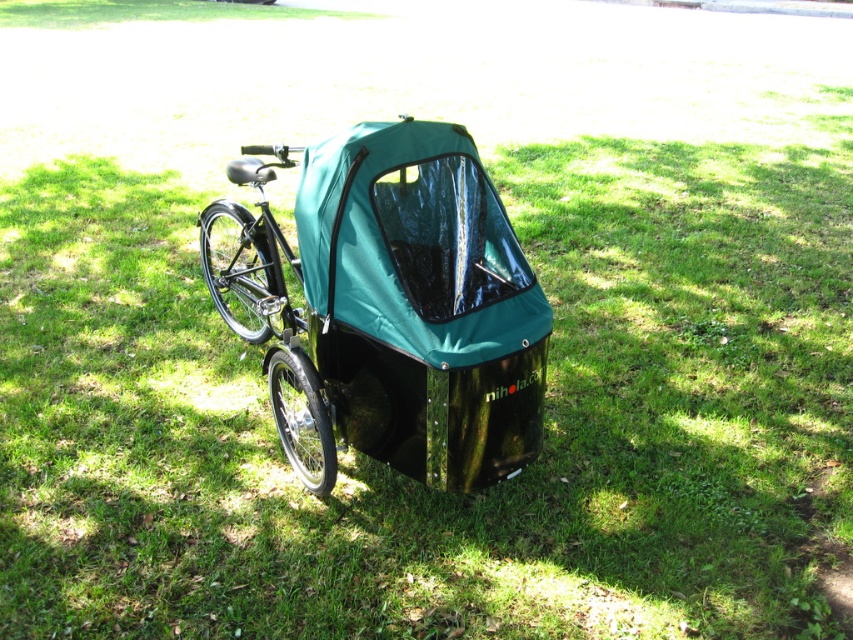
Question: Which point is closer to the camera taking this photo?

Choices:
 (A) (218, 211)
 (B) (242, 262)

Answer: (A)

Question: Does teal glossy baby carriage at center appear on the left side of black matte bicycle at left?

Choices:
 (A) no
 (B) yes

Answer: (A)

Question: Which of the following is the farthest from the observer?

Choices:
 (A) 201,211
 (B) 514,301

Answer: (A)

Question: Is teal glossy baby carriage at center positioned in front of black matte bicycle at left?

Choices:
 (A) yes
 (B) no

Answer: (A)

Question: Is teal glossy baby carriage at center bigger than black matte bicycle at left?

Choices:
 (A) yes
 (B) no

Answer: (A)